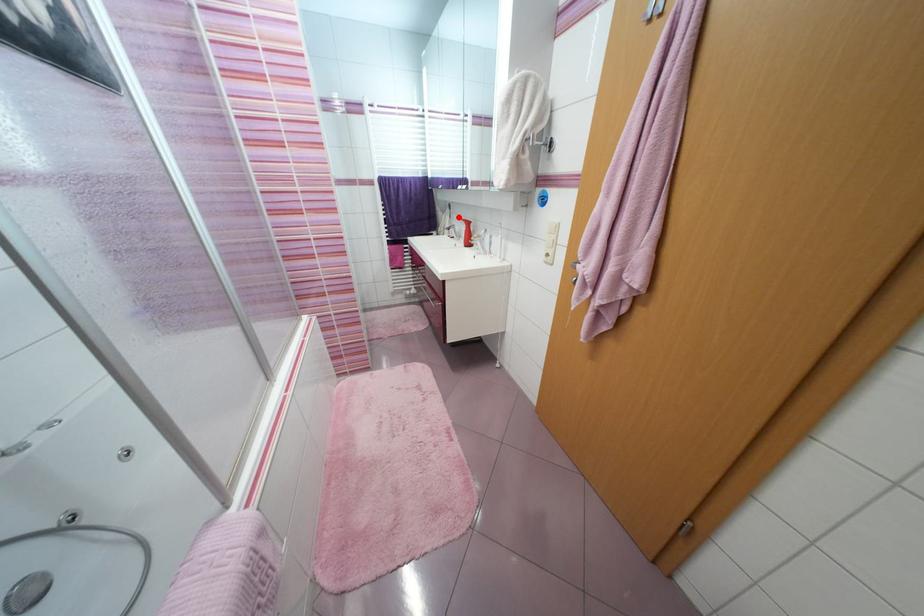
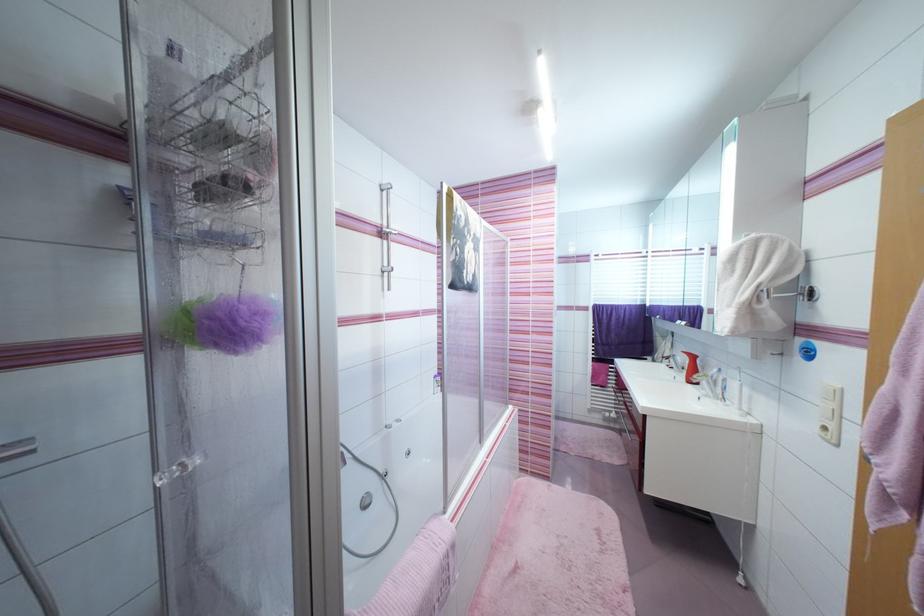
In the second image, find the point that corresponds to the highlighted location in the first image.

(682, 345)